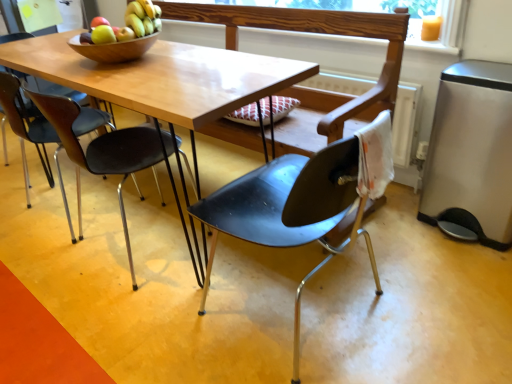
Locate an element on the screen. free space between matte black chair at center, which is the 3th chair in left-to-right order, and stainless steel trash can at right is located at coordinates (408, 261).